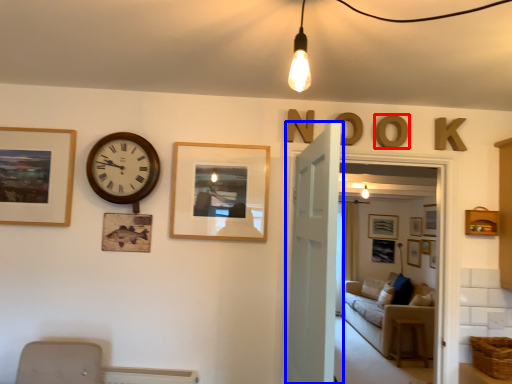
Question: Among these objects, which one is farthest to the camera, letter (highlighted by a red box) or door (highlighted by a blue box)?

Choices:
 (A) letter
 (B) door

Answer: (A)